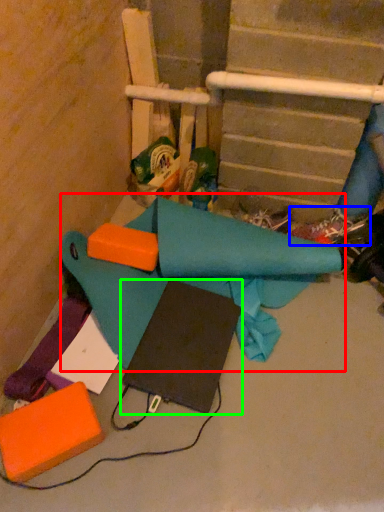
Question: Considering the real-world distances, which object is farthest from fabric (highlighted by a red box)? footwear (highlighted by a blue box) or notebook (highlighted by a green box)?

Choices:
 (A) footwear
 (B) notebook

Answer: (A)